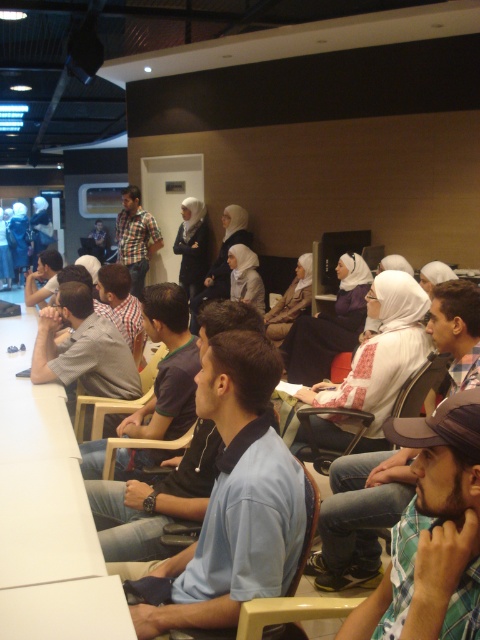
Question: Is plastic chair at center wider than light brown plastic chair at center?

Choices:
 (A) no
 (B) yes

Answer: (B)

Question: Can you confirm if light blue shirt at center is positioned to the right of light brown plastic chair at center?

Choices:
 (A) yes
 (B) no

Answer: (B)

Question: Is light blue shirt at center below white matte hijab at center?

Choices:
 (A) yes
 (B) no

Answer: (A)

Question: Which point is closer to the camera?

Choices:
 (A) plaid shirt at center
 (B) plastic chair at center
 (C) light blue shirt at center
 (D) wooden chair at center

Answer: (C)

Question: Which of the following is the farthest from the observer?

Choices:
 (A) [x=406, y=394]
 (B) [x=130, y=406]
 (C) [x=139, y=284]
 (D) [x=380, y=362]

Answer: (C)

Question: Which point is farther from the camera taking this photo?

Choices:
 (A) (128, 230)
 (B) (247, 376)
 (C) (315, 484)

Answer: (A)